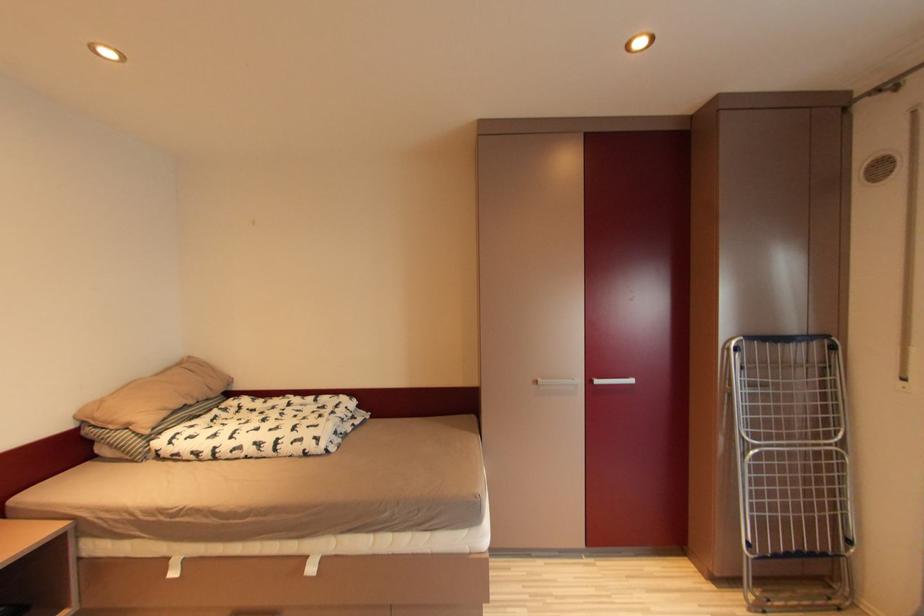
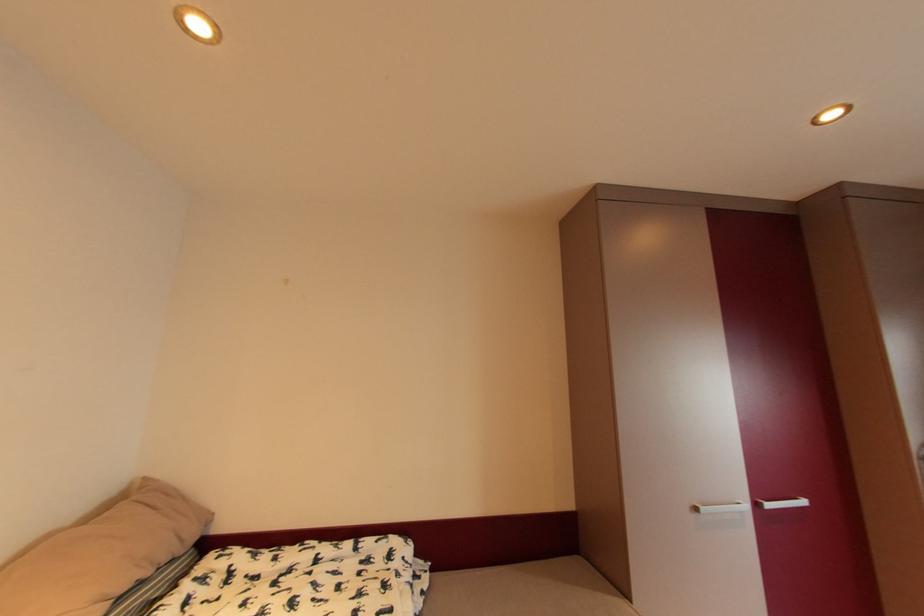
Which direction would the cameraman need to move to produce the second image?

The cameraman walked toward left, forward.